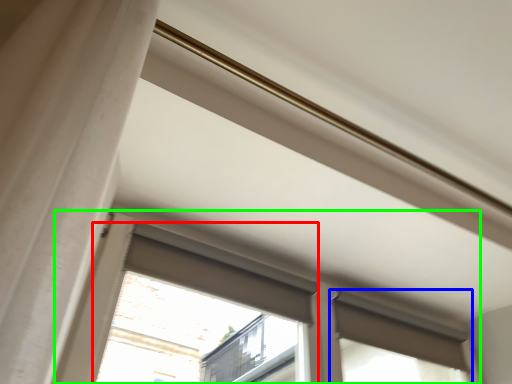
Question: Which is farther away from bay window (highlighted by a red box)? window (highlighted by a blue box) or window (highlighted by a green box)?

Choices:
 (A) window
 (B) window

Answer: (B)